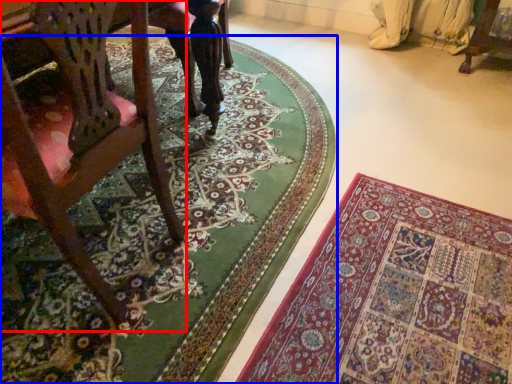
Question: Which point is closer to the camera, chair (highlighted by a red box) or mat (highlighted by a blue box)?

Choices:
 (A) chair
 (B) mat

Answer: (A)